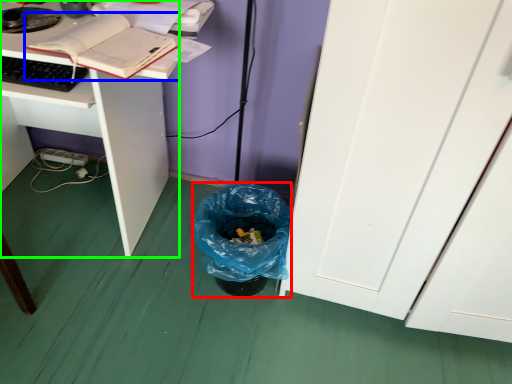
Question: Considering the real-world distances, which object is farthest from trash bin/can (highlighted by a red box)? book (highlighted by a blue box) or desk (highlighted by a green box)?

Choices:
 (A) book
 (B) desk

Answer: (A)